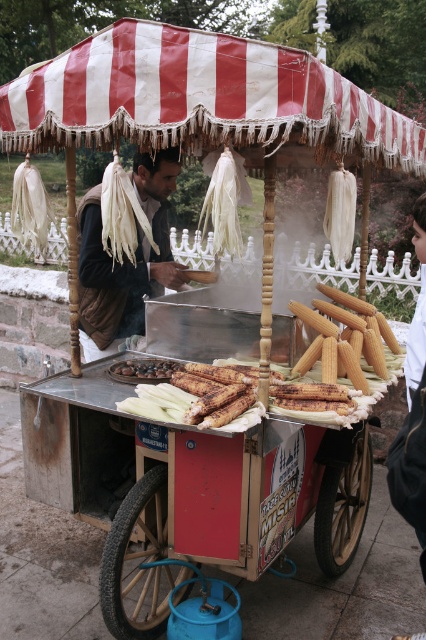
The height and width of the screenshot is (640, 426). Describe the element at coordinates (198, 97) in the screenshot. I see `red and white striped canopy at upper center` at that location.

Does red and white striped canopy at upper center appear on the right side of brown leather jacket at center?

Indeed, red and white striped canopy at upper center is positioned on the right side of brown leather jacket at center.

I want to click on red and white striped canopy at upper center, so click(198, 97).

Find the location of a particular element. Image resolution: width=426 pixels, height=640 pixels. red and white striped canopy at upper center is located at coordinates (198, 97).

Between yellow matte corn at center and shiny dark chocolate at center, which one has more height?

yellow matte corn at center

Is point (319, 301) less distant than point (152, 358)?

Yes, point (319, 301) is closer to viewer.

Does point (345, 330) lie in front of point (164, 369)?

No, it is behind (164, 369).

The width and height of the screenshot is (426, 640). I want to click on yellow matte corn at center, so click(x=347, y=336).

Between point (94, 310) and point (138, 360), which one is positioned in front?

Point (138, 360) is more forward.

Can you confirm if brown leather jacket at center is wider than shiny dark chocolate at center?

Yes, brown leather jacket at center is wider than shiny dark chocolate at center.

Does point (134, 308) come in front of point (120, 364)?

No, (134, 308) is further to viewer.

Locate an element on the screen. brown leather jacket at center is located at coordinates (126, 259).